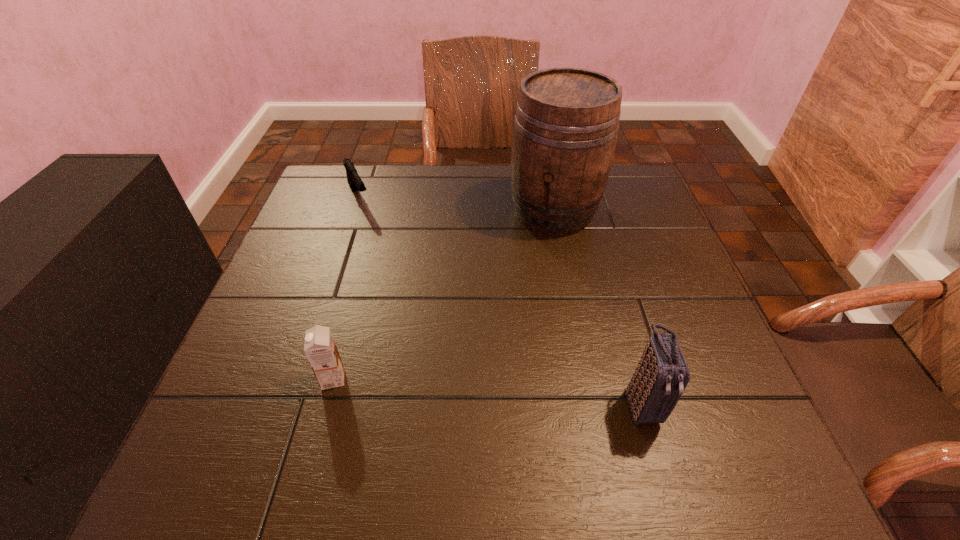
Find the location of `vacant position located on the front-facing side of the pistol`. vacant position located on the front-facing side of the pistol is located at coordinates (406, 290).

At what (x,y) coordinates should I click in order to perform the action: click on cider at the far edge. Please return your answer as a coordinate pair (x, y). Looking at the image, I should click on (565, 130).

Image resolution: width=960 pixels, height=540 pixels. I want to click on pistol that is at the far edge, so click(354, 180).

Locate an element on the screen. The width and height of the screenshot is (960, 540). chocolate milk that is positioned at the near edge is located at coordinates (320, 348).

This screenshot has height=540, width=960. In order to click on clutch bag positioned at the near edge in this screenshot , I will do `click(662, 374)`.

This screenshot has height=540, width=960. Find the location of `object located at the left edge`. object located at the left edge is located at coordinates (354, 180).

Where is `clutch bag at the right edge`? This screenshot has width=960, height=540. clutch bag at the right edge is located at coordinates (662, 374).

The image size is (960, 540). In order to click on cider at the right edge in this screenshot , I will do `click(565, 130)`.

Locate an element on the screen. object positioned at the far left corner is located at coordinates (354, 180).

Image resolution: width=960 pixels, height=540 pixels. What are the coordinates of `object that is at the far right corner` in the screenshot? It's located at [x=565, y=130].